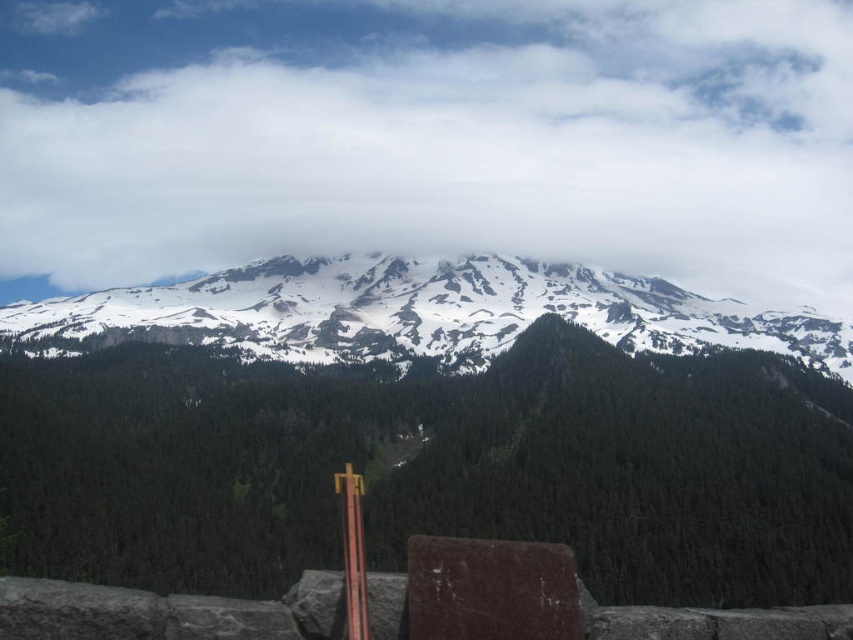
You are looking at the mountain landscape and notice a point marked at coordinates (x=430, y=136). Based on the scene description, what object is located at this point?

The point at coordinates (x=430, y=136) is on a white fluffy cloud at upper center.